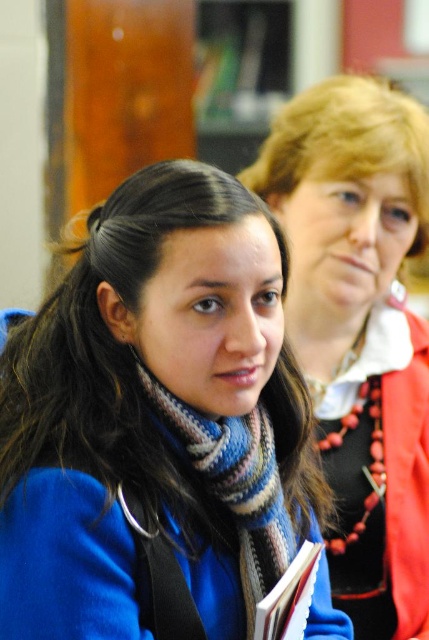
Question: Can you confirm if matte black jacket at upper right is positioned to the left of knitted wool scarf at center?

Choices:
 (A) yes
 (B) no

Answer: (B)

Question: Which of the following is the farthest from the observer?

Choices:
 (A) knitted wool scarf at center
 (B) matte black jacket at upper right
 (C) blue woolen scarf at center

Answer: (B)

Question: Does matte black jacket at upper right appear on the left side of knitted wool scarf at center?

Choices:
 (A) no
 (B) yes

Answer: (A)

Question: Does blue woolen scarf at center appear over knitted wool scarf at center?

Choices:
 (A) yes
 (B) no

Answer: (A)

Question: Which object is the farthest from the blue woolen scarf at center?

Choices:
 (A) knitted wool scarf at center
 (B) matte black jacket at upper right

Answer: (B)

Question: Which of these objects is positioned farthest from the knitted wool scarf at center?

Choices:
 (A) matte black jacket at upper right
 (B) blue woolen scarf at center

Answer: (A)